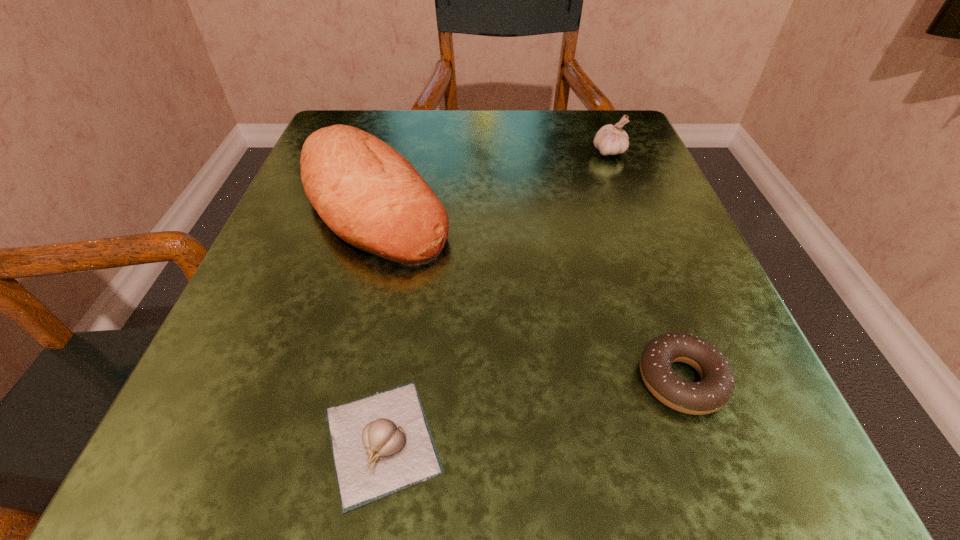
Identify the location of the tallest object. (368, 194).

Locate an element on the screen. the farther garlic is located at coordinates (610, 140).

Locate an element on the screen. Image resolution: width=960 pixels, height=540 pixels. the second tallest object is located at coordinates (610, 140).

Where is `doughnut`? doughnut is located at coordinates (716, 387).

At what (x,y) coordinates should I click in order to perform the action: click on the shortest object. Please return your answer as a coordinate pair (x, y). The image size is (960, 540). Looking at the image, I should click on (381, 444).

Find the location of `the nearer garlic`. the nearer garlic is located at coordinates (381, 444).

Find the location of a particular element. free space located on the front of the tallest object is located at coordinates (334, 343).

The width and height of the screenshot is (960, 540). Find the location of `blank area located 0.310m on the left of the right garlic`. blank area located 0.310m on the left of the right garlic is located at coordinates (434, 152).

Locate an element on the screen. This screenshot has width=960, height=540. vacant position located 0.230m on the back of the second shortest object is located at coordinates (626, 226).

The image size is (960, 540). I want to click on vacant region located 0.230m on the right of the left garlic, so click(x=665, y=441).